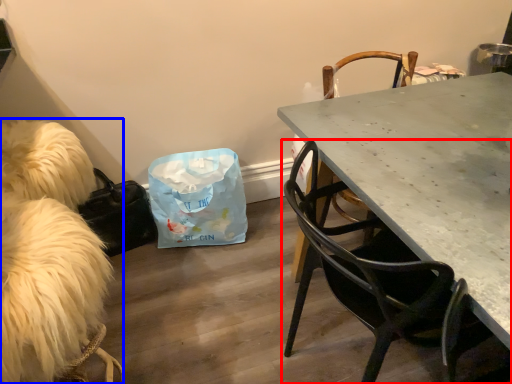
Question: Which point is further to the camera, chair (highlighted by a red box) or animal (highlighted by a blue box)?

Choices:
 (A) chair
 (B) animal

Answer: (B)